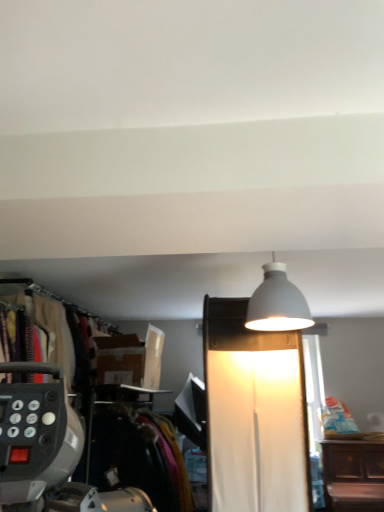
Question: Is white matte lamp at upper center, the second lamp when ordered from top to bottom, facing towards velvet-like fabric at left?

Choices:
 (A) yes
 (B) no

Answer: (B)

Question: Considering the relative sizes of white matte lamp at upper center, the 1th lamp from the bottom, and velvet-like fabric at left in the image provided, is white matte lamp at upper center, the 1th lamp from the bottom, taller than velvet-like fabric at left?

Choices:
 (A) yes
 (B) no

Answer: (A)

Question: Is white matte lamp at upper center, the 1th lamp from the bottom, in front of velvet-like fabric at left?

Choices:
 (A) no
 (B) yes

Answer: (B)

Question: Does white matte lamp at upper center, the second lamp when ordered from top to bottom, contain velvet-like fabric at left?

Choices:
 (A) yes
 (B) no

Answer: (B)

Question: From the image's perspective, does white matte lamp at upper center, the 1th lamp from the bottom, appear higher than velvet-like fabric at left?

Choices:
 (A) yes
 (B) no

Answer: (A)

Question: From a real-world perspective, is white matte lamp at upper center, the second lamp when ordered from top to bottom, positioned over velvet-like fabric at left based on gravity?

Choices:
 (A) no
 (B) yes

Answer: (B)

Question: Is black fabric closet at left directly adjacent to white matte lampshade at upper center, positioned as the first lamp in top-to-bottom order?

Choices:
 (A) no
 (B) yes

Answer: (A)

Question: From a real-world perspective, is black fabric closet at left physically above white matte lampshade at upper center, positioned as the first lamp in top-to-bottom order?

Choices:
 (A) no
 (B) yes

Answer: (A)

Question: Can you confirm if black fabric closet at left is thinner than white matte lampshade at upper center, positioned as the first lamp in top-to-bottom order?

Choices:
 (A) no
 (B) yes

Answer: (A)

Question: Considering the relative positions of black fabric closet at left and white matte lampshade at upper center, marked as the second lamp in a bottom-to-top arrangement, in the image provided, is black fabric closet at left behind white matte lampshade at upper center, marked as the second lamp in a bottom-to-top arrangement,?

Choices:
 (A) yes
 (B) no

Answer: (A)

Question: Is black fabric closet at left facing away from white matte lampshade at upper center, positioned as the first lamp in top-to-bottom order?

Choices:
 (A) no
 (B) yes

Answer: (A)

Question: Is the depth of black fabric closet at left less than that of white matte lampshade at upper center, marked as the second lamp in a bottom-to-top arrangement?

Choices:
 (A) yes
 (B) no

Answer: (B)

Question: Does white matte lamp at upper center, the 1th lamp from the bottom, lie in front of white matte lampshade at upper center, positioned as the first lamp in top-to-bottom order?

Choices:
 (A) no
 (B) yes

Answer: (B)